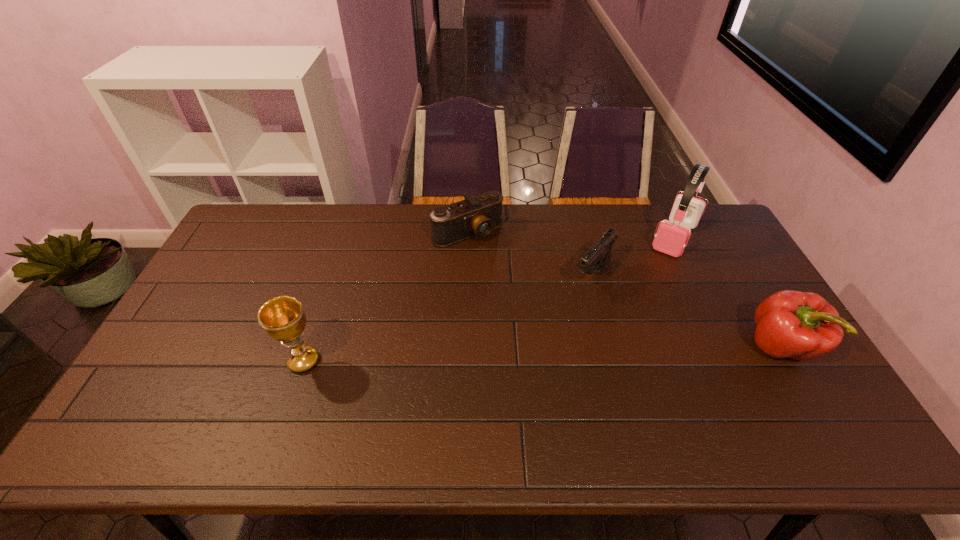
Where is `vacant space located at the barrel of the pistol`? The height and width of the screenshot is (540, 960). vacant space located at the barrel of the pistol is located at coordinates (518, 366).

Locate an element on the screen. vacant area located 0.400m on the outer surface of the earphone is located at coordinates (622, 334).

Locate an element on the screen. This screenshot has height=540, width=960. vacant area situated 0.130m on the outer surface of the earphone is located at coordinates (653, 279).

Locate an element on the screen. The width and height of the screenshot is (960, 540). blank space located 0.150m on the outer surface of the earphone is located at coordinates (651, 282).

Find the location of a particular element. The width and height of the screenshot is (960, 540). vacant region located on the lens of the shortest object is located at coordinates (495, 258).

What are the coordinates of `vacant space located 0.300m on the lens of the shortest object` in the screenshot? It's located at (535, 302).

You are a GUI agent. You are given a task and a screenshot of the screen. Output one action in this format:
    pyautogui.click(x=<x>, y=<y>)
    Task: Click on the vacant space situated on the lens of the shortest object
    
    Given the screenshot: What is the action you would take?
    pyautogui.click(x=535, y=302)

At what (x,y) coordinates should I click in order to perform the action: click on earphone at the far edge. Please return your answer as a coordinate pair (x, y). The height and width of the screenshot is (540, 960). Looking at the image, I should click on (671, 238).

Where is `camera situated at the far edge`? camera situated at the far edge is located at coordinates 478,216.

At what (x,y) coordinates should I click in order to perform the action: click on pepper at the right edge. Please return your answer as a coordinate pair (x, y). Image resolution: width=960 pixels, height=540 pixels. Looking at the image, I should click on pyautogui.click(x=790, y=324).